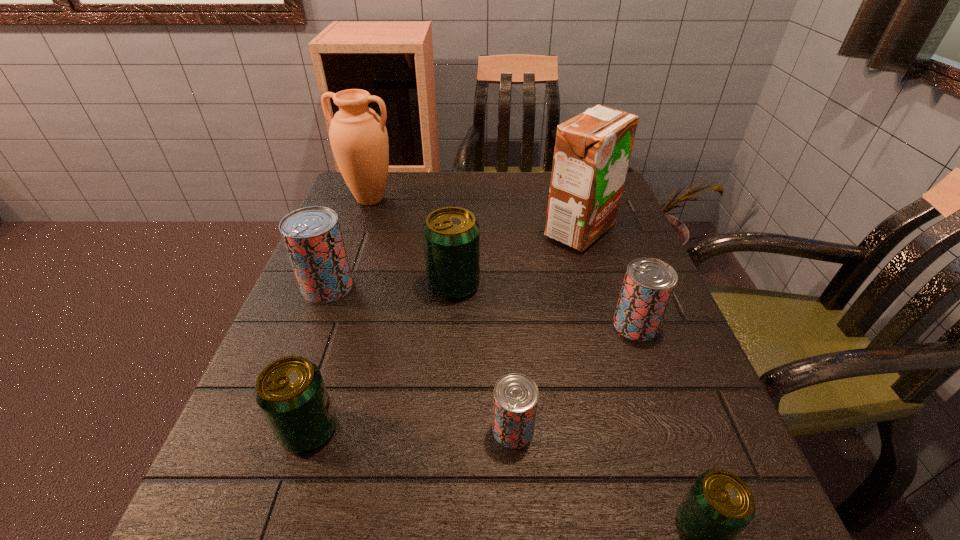
The width and height of the screenshot is (960, 540). Find the location of `urn`. urn is located at coordinates (358, 136).

Find the location of `carton`. carton is located at coordinates (592, 151).

At what (x,y) coordinates should I click in order to perform the action: click on the second green beer can from left to right. Please return your answer as a coordinate pair (x, y). The image size is (960, 540). Looking at the image, I should click on (451, 235).

This screenshot has height=540, width=960. I want to click on the biggest green beer can, so click(x=451, y=235).

Identify the location of the biggest red beer can. (312, 236).

The image size is (960, 540). I want to click on the farthest red beer can, so click(x=312, y=236).

Find the location of a particular element. Image resolution: width=960 pixels, height=540 pixels. the rightmost red beer can is located at coordinates (648, 285).

Where is `the third farthest beer can`? the third farthest beer can is located at coordinates click(648, 285).

Locate an element on the screen. the second biggest green beer can is located at coordinates (290, 391).

The image size is (960, 540). Find the location of `the leftmost green beer can`. the leftmost green beer can is located at coordinates (290, 391).